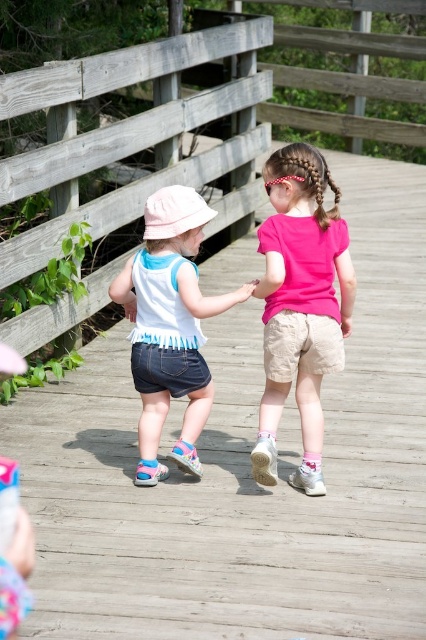
Is wooden bridge at center bigger than pink fabric hand at center?

Indeed, wooden bridge at center has a larger size compared to pink fabric hand at center.

Consider the image. Can you confirm if wooden bridge at center is positioned to the right of pink fabric hand at center?

Correct, you'll find wooden bridge at center to the right of pink fabric hand at center.

Measure the distance between wooden bridge at center and camera.

wooden bridge at center is 5.37 meters away from camera.

Locate an element on the screen. Image resolution: width=426 pixels, height=640 pixels. wooden bridge at center is located at coordinates (189, 118).

Is pink matte shorts at center behind pink fabric hand at center?

That is False.

Can you confirm if pink matte shorts at center is wider than pink fabric hand at center?

Indeed, pink matte shorts at center has a greater width compared to pink fabric hand at center.

Locate an element on the screen. The height and width of the screenshot is (640, 426). pink matte shorts at center is located at coordinates (x=301, y=305).

Can you confirm if wooden bridge at center is bigger than denim shorts at center?

Yes.

Is point (106, 131) more distant than point (129, 268)?

Yes.

Between point (43, 323) and point (178, 317), which one is positioned behind?

Point (43, 323)

Where is `wooden bridge at center`? The width and height of the screenshot is (426, 640). wooden bridge at center is located at coordinates (189, 118).